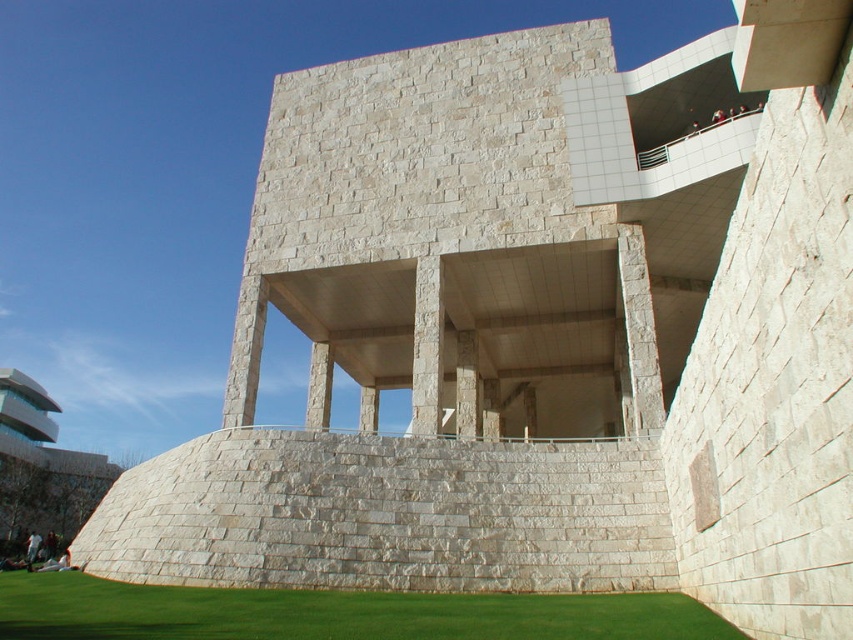
Find the location of a particular element. The image size is (853, 640). green grass at lower center is located at coordinates (334, 612).

Between green grass at lower center and natural stone column at center, which one appears on the left side from the viewer's perspective?

Positioned to the left is green grass at lower center.

Measure the distance between green grass at lower center and camera.

16.92 meters

I want to click on green grass at lower center, so click(334, 612).